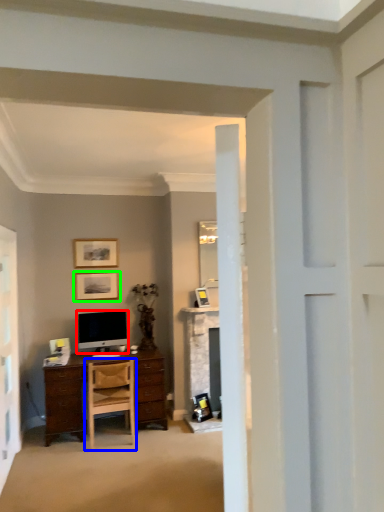
Question: Based on their relative distances, which object is farther from television (highlighted by a red box)? Choose from chair (highlighted by a blue box) and picture frame (highlighted by a green box).

Choices:
 (A) chair
 (B) picture frame

Answer: (A)